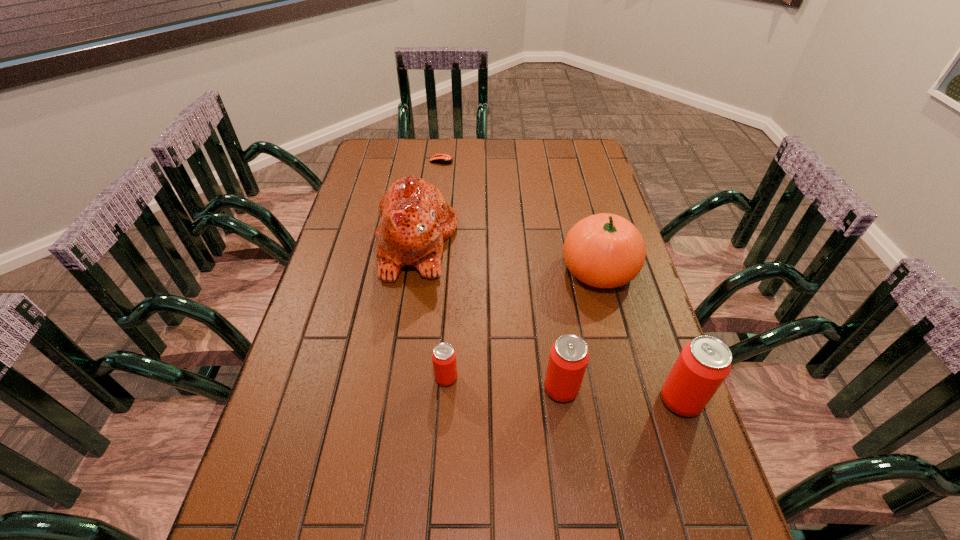
Identify the location of vacant space at the near edge. The height and width of the screenshot is (540, 960). (372, 485).

Find the location of a particular element. The height and width of the screenshot is (540, 960). vacant region at the left edge of the desktop is located at coordinates (361, 276).

The width and height of the screenshot is (960, 540). I want to click on free spot at the right edge of the desktop, so click(630, 411).

At what (x,y) coordinates should I click in order to perform the action: click on vacant point located between the leftmost beer can and the fourth tallest object. Please return your answer as a coordinate pair (x, y). The width and height of the screenshot is (960, 540). Looking at the image, I should click on (504, 383).

At what (x,y) coordinates should I click in order to perform the action: click on vacant point located between the pumpkin and the second tallest beer can. Please return your answer as a coordinate pair (x, y). This screenshot has width=960, height=540. Looking at the image, I should click on (580, 329).

I want to click on free space between the second shortest beer can and the cat, so click(x=489, y=315).

Where is `unoccupied area between the second shortest object and the cat`? This screenshot has height=540, width=960. unoccupied area between the second shortest object and the cat is located at coordinates (431, 310).

Find the location of a particular element. This screenshot has width=960, height=540. vacant area between the computer mouse and the fourth tallest object is located at coordinates (501, 275).

I want to click on unoccupied area between the second shortest beer can and the pumpkin, so click(x=580, y=329).

Locate an element on the screen. This screenshot has height=540, width=960. vacant space that's between the second shortest object and the pumpkin is located at coordinates (522, 323).